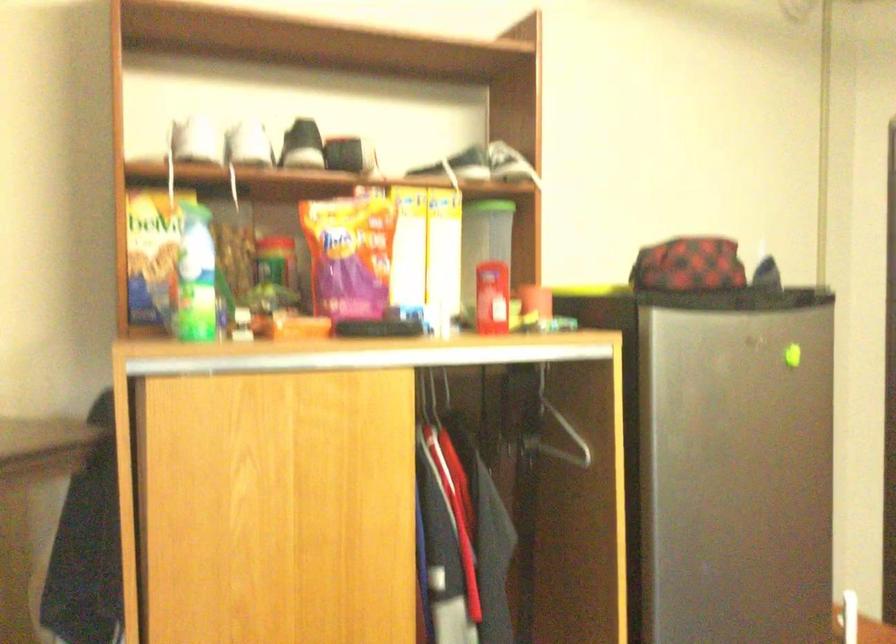
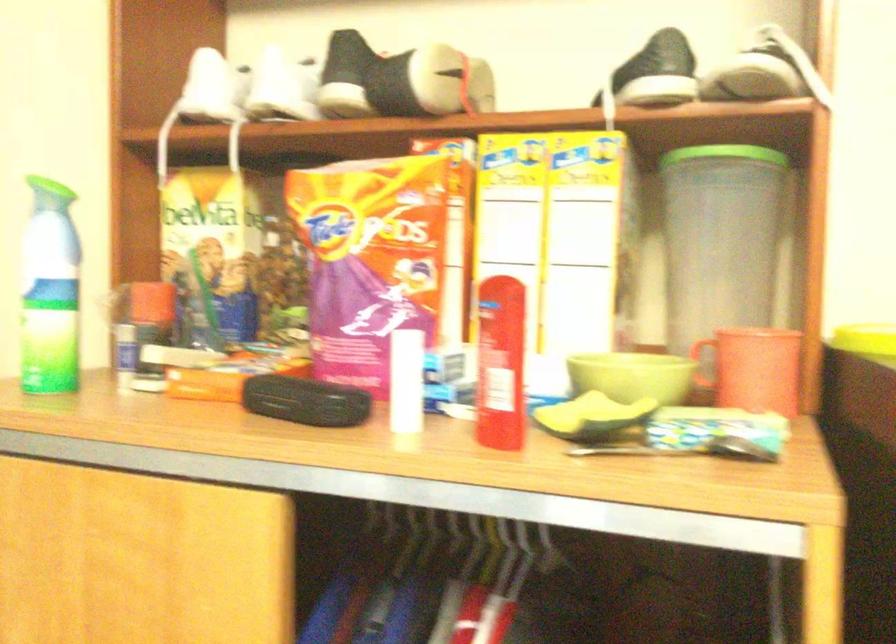
Locate, in the second image, the point that corresponds to [399,327] in the first image.

(306, 401)